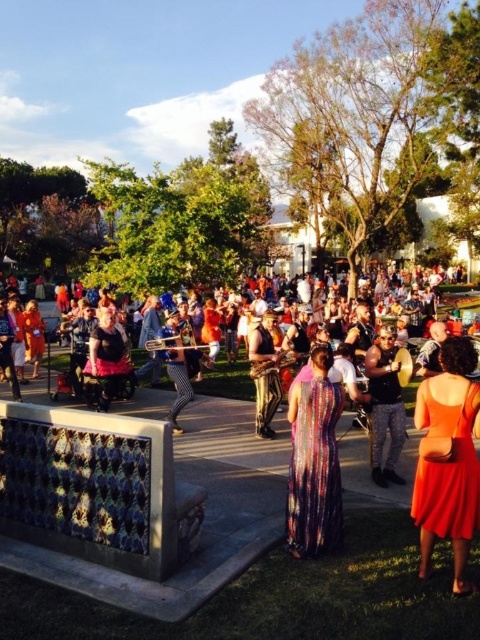
Which is above, multicolored fabric dress at center or multicolored sequined dress at center?

multicolored sequined dress at center is above.

Who is more forward, (x=49, y=474) or (x=311, y=499)?

Point (x=311, y=499) is more forward.

You are a GUI agent. You are given a task and a screenshot of the screen. Output one action in this format:
    pyautogui.click(x=<x>, y=<y>)
    Task: Click on the multicolored fabric dress at center
    The height and width of the screenshot is (640, 480).
    Given the screenshot: What is the action you would take?
    pyautogui.click(x=136, y=497)

Can you confirm if orange satin dress at center is smaller than multicolored sequined dress at center?

Actually, orange satin dress at center might be larger than multicolored sequined dress at center.

Is orange satin dress at center to the right of multicolored sequined dress at center from the viewer's perspective?

Correct, you'll find orange satin dress at center to the right of multicolored sequined dress at center.

Between point (468, 420) and point (299, 419), which one is positioned behind?

Point (299, 419)

At what (x,y) coordinates should I click in order to perform the action: click on orange satin dress at center. Please return your answer as a coordinate pair (x, y). The height and width of the screenshot is (640, 480). Looking at the image, I should click on (447, 460).

Is camouflage pants at center above shiny gold pants at center?

No, camouflage pants at center is not above shiny gold pants at center.

Can you confirm if camouflage pants at center is positioned to the left of shiny gold pants at center?

No, camouflage pants at center is not to the left of shiny gold pants at center.

Locate an element on the screen. The image size is (480, 640). camouflage pants at center is located at coordinates (384, 406).